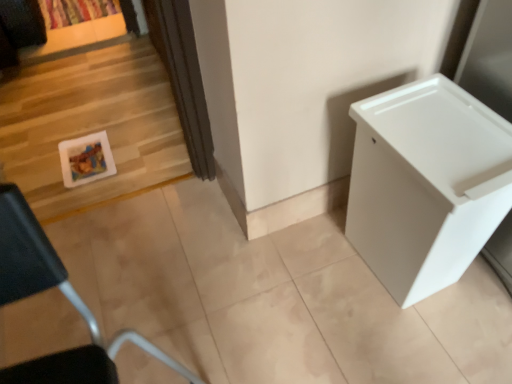
What are the coordinates of `vacant space in between white plastic container at lower left and white plastic changing table at right` in the screenshot? It's located at (306, 319).